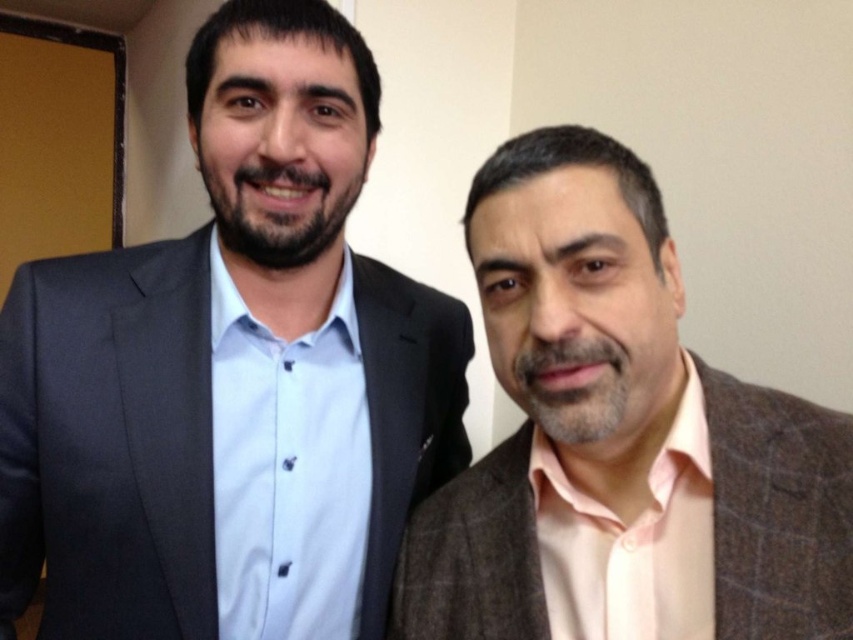
Question: Considering the relative positions of matte black suit at left and brown textured suit at right in the image provided, where is matte black suit at left located with respect to brown textured suit at right?

Choices:
 (A) right
 (B) left

Answer: (B)

Question: Is matte black suit at left to the right of brown textured suit at right from the viewer's perspective?

Choices:
 (A) no
 (B) yes

Answer: (A)

Question: Which object is closer to the camera taking this photo?

Choices:
 (A) brown textured suit at right
 (B) matte black suit at left

Answer: (A)

Question: Among these points, which one is nearest to the camera?

Choices:
 (A) (711, 396)
 (B) (74, 496)

Answer: (A)

Question: Among these objects, which one is nearest to the camera?

Choices:
 (A) matte black suit at left
 (B) brown textured suit at right

Answer: (B)

Question: Where is matte black suit at left located in relation to brown textured suit at right in the image?

Choices:
 (A) left
 (B) right

Answer: (A)